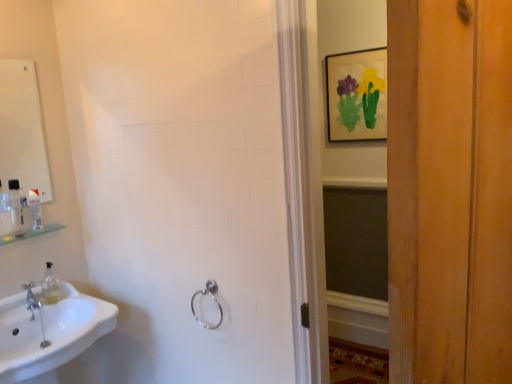
Question: Can you confirm if white glossy sink at lower left is smaller than green glass shelf at left?

Choices:
 (A) no
 (B) yes

Answer: (A)

Question: From the image's perspective, is white glossy sink at lower left located above green glass shelf at left?

Choices:
 (A) yes
 (B) no

Answer: (B)

Question: Can we say white glossy sink at lower left lies outside green glass shelf at left?

Choices:
 (A) no
 (B) yes

Answer: (B)

Question: From the image's perspective, does white glossy sink at lower left appear lower than green glass shelf at left?

Choices:
 (A) yes
 (B) no

Answer: (A)

Question: Is white glossy sink at lower left turned away from green glass shelf at left?

Choices:
 (A) yes
 (B) no

Answer: (B)

Question: Considering the relative sizes of white glossy sink at lower left and green glass shelf at left in the image provided, is white glossy sink at lower left thinner than green glass shelf at left?

Choices:
 (A) yes
 (B) no

Answer: (B)

Question: Is there a large distance between matte paper picture frame at upper center and silver metallic towel ring at lower center?

Choices:
 (A) no
 (B) yes

Answer: (B)

Question: Is matte paper picture frame at upper center looking in the opposite direction of silver metallic towel ring at lower center?

Choices:
 (A) no
 (B) yes

Answer: (A)

Question: Does matte paper picture frame at upper center have a lesser width compared to silver metallic towel ring at lower center?

Choices:
 (A) no
 (B) yes

Answer: (B)

Question: From a real-world perspective, is matte paper picture frame at upper center located higher than silver metallic towel ring at lower center?

Choices:
 (A) no
 (B) yes

Answer: (B)

Question: Does matte paper picture frame at upper center appear on the right side of silver metallic towel ring at lower center?

Choices:
 (A) no
 (B) yes

Answer: (B)

Question: Can you confirm if matte paper picture frame at upper center is shorter than silver metallic towel ring at lower center?

Choices:
 (A) yes
 (B) no

Answer: (B)

Question: Does white glossy mirror at upper left have a greater height compared to silver metallic towel ring at lower center?

Choices:
 (A) yes
 (B) no

Answer: (A)